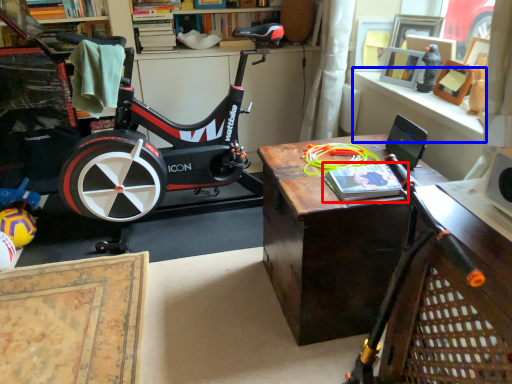
Question: Which of the following is the closest to the observer, book (highlighted by a red box) or window sill (highlighted by a blue box)?

Choices:
 (A) book
 (B) window sill

Answer: (A)